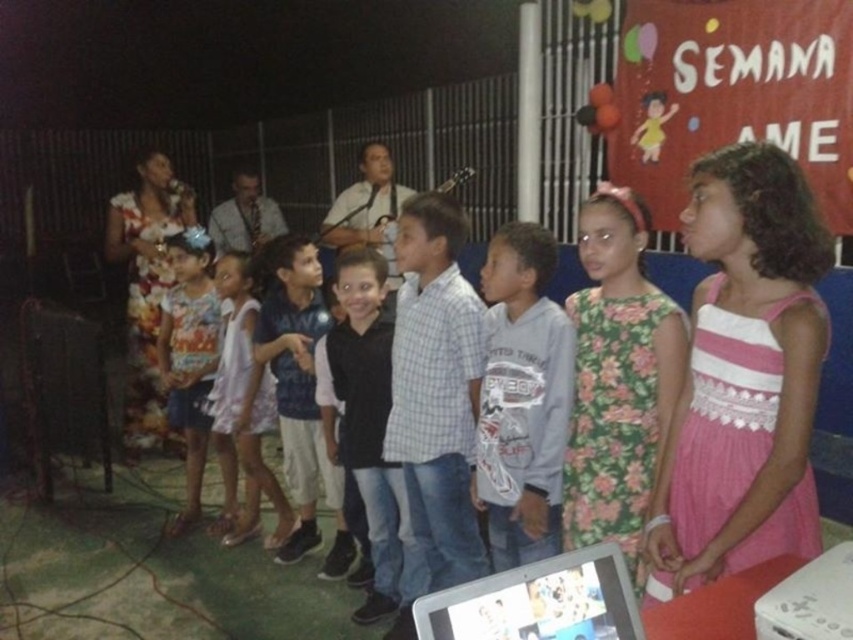
Question: Considering the real-world distances, which object is closest to the floral dress at center?

Choices:
 (A) black matte vest at center
 (B) dark blue jersey at center
 (C) light pink fabric dress at center

Answer: (A)

Question: Where is floral dress at center located in relation to silver plastic tablet at center in the image?

Choices:
 (A) right
 (B) left

Answer: (A)

Question: Estimate the real-world distances between objects in this image. Which object is farther from the pink cotton dress at center?

Choices:
 (A) printed cotton dress at center
 (B) black matte vest at center
 (C) floral dress at center
 (D) dark blue jersey at center

Answer: (A)

Question: Can you confirm if pink cotton dress at center is bigger than floral dress at center?

Choices:
 (A) no
 (B) yes

Answer: (B)

Question: Is pink cotton dress at center wider than printed cotton dress at center?

Choices:
 (A) no
 (B) yes

Answer: (A)

Question: Among these objects, which one is farthest from the camera?

Choices:
 (A) gray cotton shirt at center
 (B) printed cotton dress at center
 (C) black matte vest at center
 (D) light pink fabric dress at center

Answer: (B)